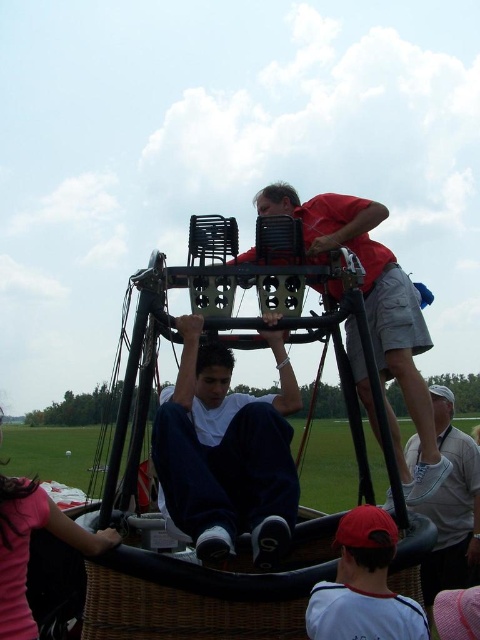
Question: Considering the real-world distances, which object is farthest from the woven wicker basket at lower center?

Choices:
 (A) gray fabric cap at lower right
 (B) dark blue fabric pants at center
 (C) red shirt at upper center

Answer: (C)

Question: Is woven wicker basket at lower center further to camera compared to red shirt at upper center?

Choices:
 (A) no
 (B) yes

Answer: (A)

Question: Is woven wicker basket at lower center to the left of red shirt at upper center from the viewer's perspective?

Choices:
 (A) yes
 (B) no

Answer: (A)

Question: Estimate the real-world distances between objects in this image. Which object is farther from the dark blue fabric pants at center?

Choices:
 (A) gray fabric cap at lower right
 (B) matte red cap at lower center
 (C) red shirt at upper center

Answer: (A)

Question: Which object is the farthest from the matte pink shirt at lower left?

Choices:
 (A) gray fabric cap at lower right
 (B) matte red cap at lower center
 (C) dark blue fabric pants at center
 (D) red shirt at upper center

Answer: (A)

Question: Considering the relative positions of woven wicker basket at lower center and matte red cap at lower center in the image provided, where is woven wicker basket at lower center located with respect to matte red cap at lower center?

Choices:
 (A) above
 (B) below

Answer: (B)